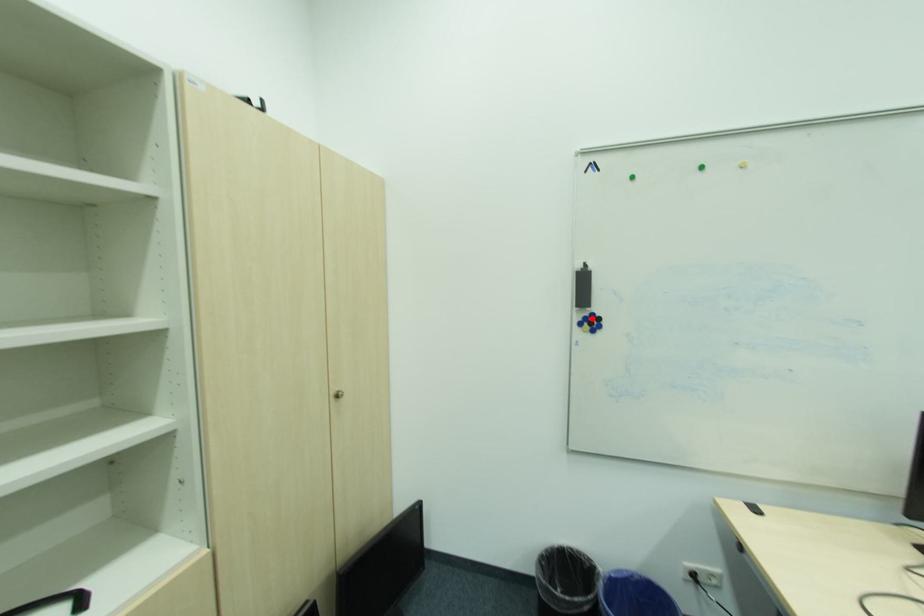
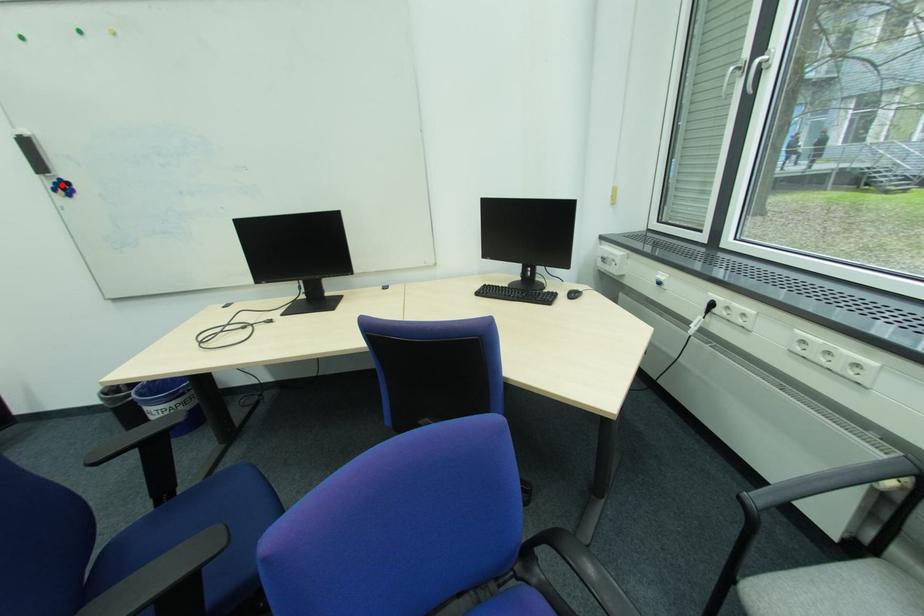
I am providing you with two images of the same scene from different viewpoints. A red point is marked on the first image and another point is marked on the second image. Is the red point in image1 aligned with the point shown in image2?

Yes